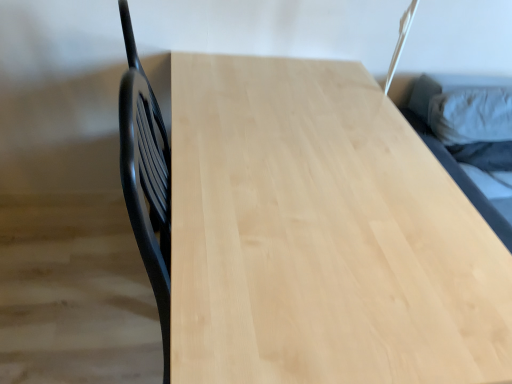
Question: Should I look upward or downward to see light wood table at center?

Choices:
 (A) up
 (B) down

Answer: (B)